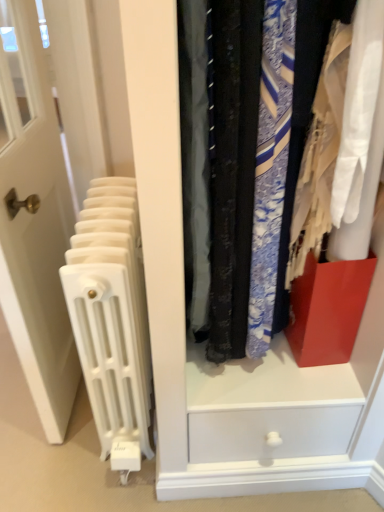
Question: Is matte plastic drawer at center at the right side of white plastic radiator at left?

Choices:
 (A) no
 (B) yes

Answer: (B)

Question: Is matte plastic drawer at center bigger than white plastic radiator at left?

Choices:
 (A) yes
 (B) no

Answer: (A)

Question: Is matte plastic drawer at center at the left side of white plastic radiator at left?

Choices:
 (A) yes
 (B) no

Answer: (B)

Question: From a real-world perspective, is matte plastic drawer at center beneath white plastic radiator at left?

Choices:
 (A) no
 (B) yes

Answer: (A)

Question: Is matte plastic drawer at center smaller than white plastic radiator at left?

Choices:
 (A) yes
 (B) no

Answer: (B)

Question: Does point (66, 184) appear closer or farther from the camera than point (215, 438)?

Choices:
 (A) closer
 (B) farther

Answer: (B)

Question: From a real-world perspective, relative to matte plastic drawer at center, is white glossy door at left vertically above or below?

Choices:
 (A) below
 (B) above

Answer: (A)

Question: Looking at the image, does white glossy door at left seem bigger or smaller compared to matte plastic drawer at center?

Choices:
 (A) small
 (B) big

Answer: (A)

Question: Is white glossy door at left inside or outside of matte plastic drawer at center?

Choices:
 (A) inside
 (B) outside

Answer: (B)

Question: From a real-world perspective, is matte plastic drawer at center positioned above or below white plastic radiator at left?

Choices:
 (A) above
 (B) below

Answer: (A)

Question: Relative to white plastic radiator at left, is matte plastic drawer at center in front or behind?

Choices:
 (A) front
 (B) behind

Answer: (A)

Question: Is matte plastic drawer at center wider or thinner than white plastic radiator at left?

Choices:
 (A) thin
 (B) wide

Answer: (A)

Question: From the image's perspective, is matte plastic drawer at center above or below white plastic radiator at left?

Choices:
 (A) below
 (B) above

Answer: (B)

Question: Is white plastic radiator at left taller or shorter than white glossy door at left?

Choices:
 (A) tall
 (B) short

Answer: (B)

Question: Looking at their shapes, would you say white plastic radiator at left is wider or thinner than white glossy door at left?

Choices:
 (A) thin
 (B) wide

Answer: (B)